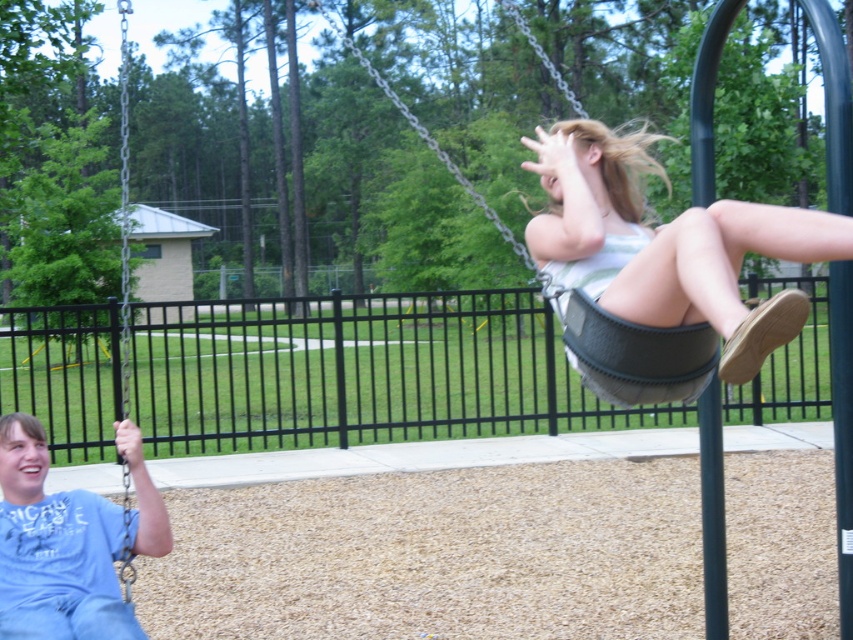
Does matte gray swing at center have a larger size compared to blue cotton shirt at lower left?

Actually, matte gray swing at center might be smaller than blue cotton shirt at lower left.

The image size is (853, 640). What are the coordinates of `matte gray swing at center` in the screenshot? It's located at (666, 243).

Is blue cotton shirt at lower left closer to camera compared to gray fabric swing at upper right?

No.

Does blue cotton shirt at lower left appear under gray fabric swing at upper right?

Yes, blue cotton shirt at lower left is below gray fabric swing at upper right.

Is point (141, 532) less distant than point (584, 310)?

No.

Where is `blue cotton shirt at lower left`? blue cotton shirt at lower left is located at coordinates (54, 548).

Does matte gray swing at center have a greater height compared to gray fabric swing at upper right?

In fact, matte gray swing at center may be shorter than gray fabric swing at upper right.

Is point (607, 147) positioned behind point (619, 384)?

Yes, point (607, 147) is farther from viewer.

Find the location of a particular element. matte gray swing at center is located at coordinates (666, 243).